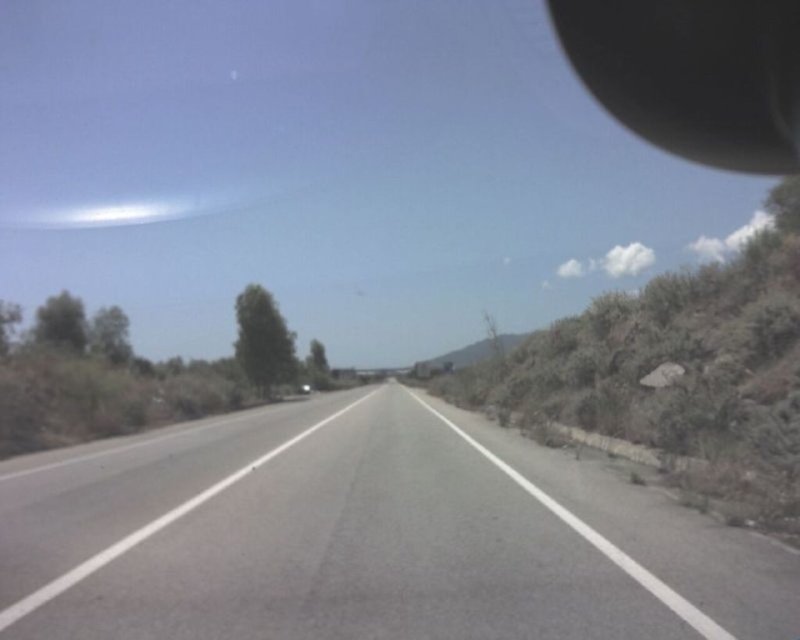
You are driving a car and need to check your blind spot. You see the asphalt road at center and the black rubber rearview mirror at upper right. Which object is lower in height?

The asphalt road at center is lower in height compared to the black rubber rearview mirror at upper right.